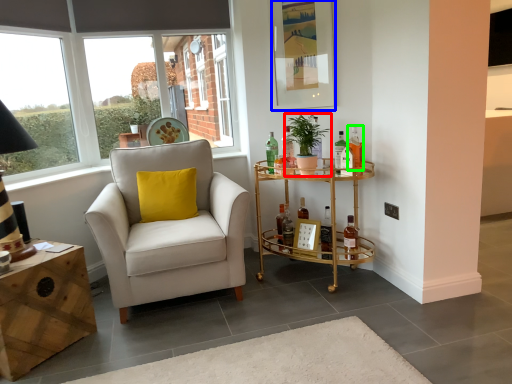
Question: Estimate the real-world distances between objects in this image. Which object is closer to houseplant (highlighted by a red box), picture frame (highlighted by a blue box) or bottle (highlighted by a green box)?

Choices:
 (A) picture frame
 (B) bottle

Answer: (B)